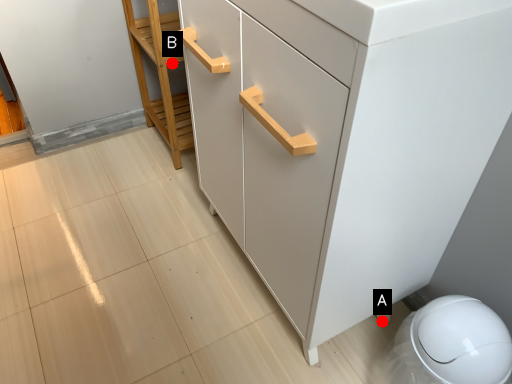
Question: Two points are circled on the image, labeled by A and B beside each circle. Which of the following is the farthest from the observer?

Choices:
 (A) A is further
 (B) B is further

Answer: (B)